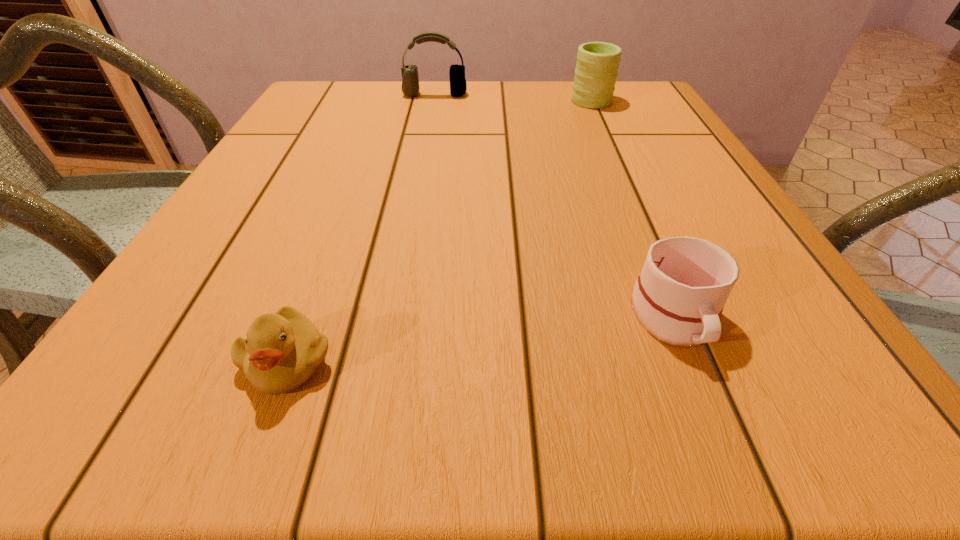
I want to click on duckling located in the near edge section of the desktop, so click(281, 351).

Image resolution: width=960 pixels, height=540 pixels. What are the coordinates of `object at the left edge` in the screenshot? It's located at (281, 351).

Identify the location of object that is at the near left corner. (281, 351).

Locate an element on the screen. This screenshot has width=960, height=540. object present at the far right corner is located at coordinates (597, 65).

At what (x,y) coordinates should I click in order to perform the action: click on object that is at the near right corner. Please return your answer as a coordinate pair (x, y). The width and height of the screenshot is (960, 540). Looking at the image, I should click on (679, 296).

This screenshot has width=960, height=540. In the image, there is a desktop. Find the location of `vacant space at the far edge`. vacant space at the far edge is located at coordinates [x=444, y=92].

In the image, there is a desktop. In order to click on blank space at the near edge in this screenshot , I will do coord(643,364).

Locate an element on the screen. This screenshot has width=960, height=540. vacant space at the left edge is located at coordinates (181, 289).

Where is `free region at the right edge of the desktop`? This screenshot has height=540, width=960. free region at the right edge of the desktop is located at coordinates (640, 163).

Where is `vacant space at the near left corner of the desktop`? Image resolution: width=960 pixels, height=540 pixels. vacant space at the near left corner of the desktop is located at coordinates (179, 382).